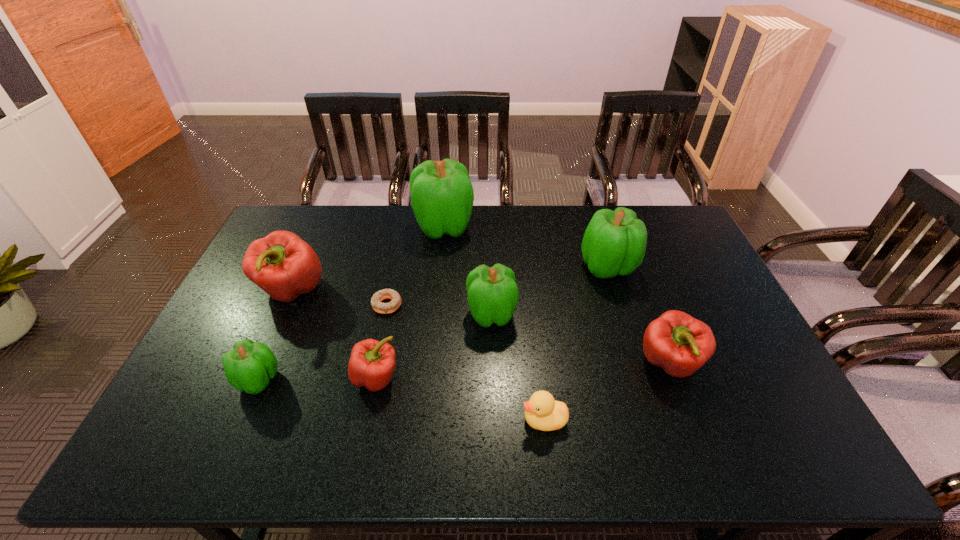
Identify which object is the second closest to the second pink bell pepper from right to left. Please provide its 2D coordinates. Your answer should be formatted as a tuple, i.e. [(x, y)], where the tuple contains the x and y coordinates of a point satisfying the conditions above.

[(250, 365)]

What are the coordinates of `the second closest object relative to the second biggest green bell pepper` in the screenshot? It's located at (493, 294).

Where is `bell pepper that stands as the sixth closest to the doughnut`? Image resolution: width=960 pixels, height=540 pixels. bell pepper that stands as the sixth closest to the doughnut is located at coordinates (614, 242).

You are a GUI agent. You are given a task and a screenshot of the screen. Output one action in this format:
    pyautogui.click(x=<x>, y=<y>)
    Task: Click on the bell pepper that is the closest one to the leftmost green bell pepper
    The height and width of the screenshot is (540, 960).
    Given the screenshot: What is the action you would take?
    pyautogui.click(x=283, y=265)

Identify which green bell pepper is the second nearest to the doughnut. Please provide its 2D coordinates. Your answer should be formatted as a tuple, i.e. [(x, y)], where the tuple contains the x and y coordinates of a point satisfying the conditions above.

[(442, 196)]

I want to click on green bell pepper that is the third closest to the leftmost green bell pepper, so click(614, 242).

Find the location of a particular element. This screenshot has height=540, width=960. pink bell pepper that is the second closest one to the second shortest object is located at coordinates (371, 364).

Image resolution: width=960 pixels, height=540 pixels. I want to click on pink bell pepper that is the second closest to the biggest green bell pepper, so (x=371, y=364).

Locate an element on the screen. The image size is (960, 540). vacant area that satisfies the following two spatial constraints: 1. on the back side of the shortest object; 2. on the right side of the third smallest green bell pepper is located at coordinates (396, 267).